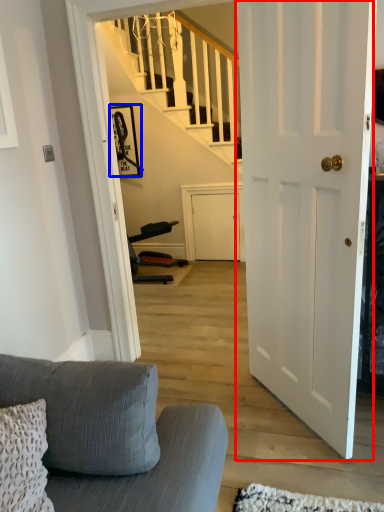
Question: Among these objects, which one is nearest to the camera, door (highlighted by a red box) or picture frame (highlighted by a blue box)?

Choices:
 (A) door
 (B) picture frame

Answer: (A)